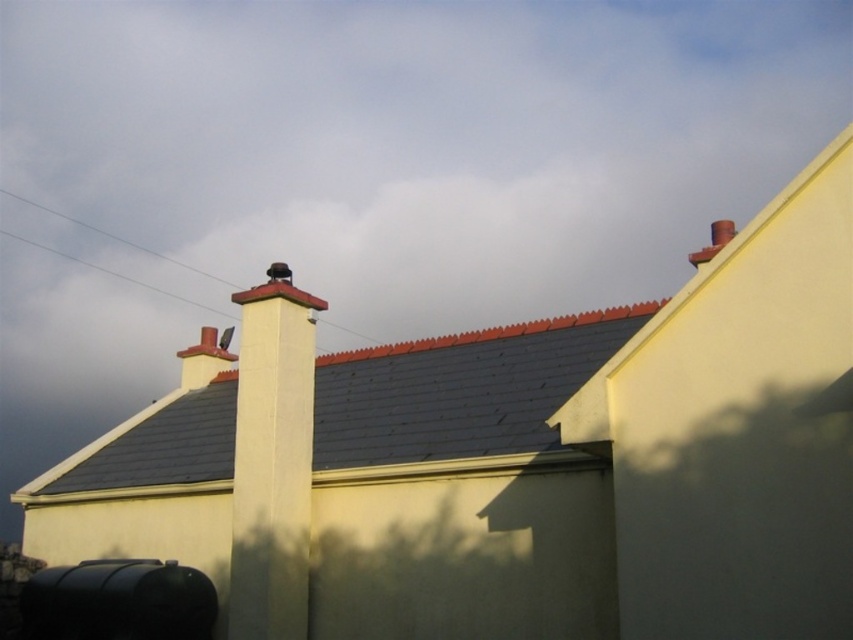
Question: Does gray slate roof at center appear on the left side of white smooth chimney at center?

Choices:
 (A) yes
 (B) no

Answer: (B)

Question: Which of the following is the closest to the observer?

Choices:
 (A) (601, 344)
 (B) (309, 513)

Answer: (B)

Question: Which point is closer to the camera taking this photo?

Choices:
 (A) (242, 404)
 (B) (381, 422)

Answer: (A)

Question: Where is gray slate roof at center located in relation to white smooth chimney at center in the image?

Choices:
 (A) left
 (B) right

Answer: (B)

Question: Which point is closer to the camera?

Choices:
 (A) white smooth chimney at center
 (B) gray slate roof at center

Answer: (B)

Question: Is gray slate roof at center smaller than white smooth chimney at center?

Choices:
 (A) no
 (B) yes

Answer: (A)